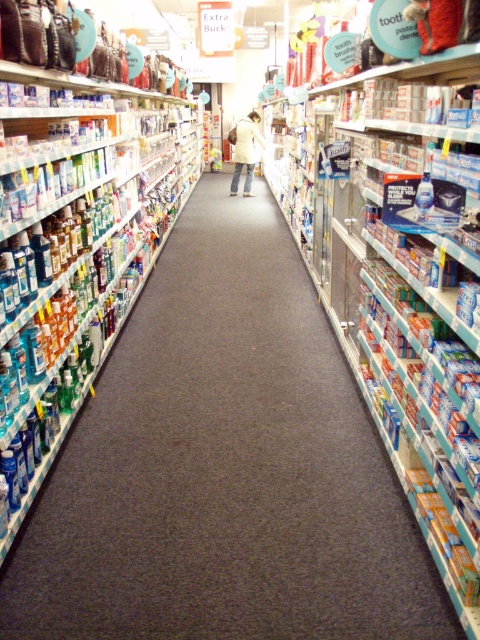
Who is positioned more to the left, blue plastic toothpaste at center or white matte coat at center?

white matte coat at center is more to the left.

This screenshot has width=480, height=640. Describe the element at coordinates (396, 269) in the screenshot. I see `blue plastic toothpaste at center` at that location.

Where is `blue plastic toothpaste at center`? blue plastic toothpaste at center is located at coordinates (396, 269).

Can you confirm if clear plastic bottles at center is smaller than white matte coat at center?

Correct, clear plastic bottles at center occupies less space than white matte coat at center.

Is point (119, 384) behind point (242, 125)?

No, (119, 384) is closer to viewer.

Describe the element at coordinates (224, 467) in the screenshot. Image resolution: width=480 pixels, height=640 pixels. I see `clear plastic bottles at center` at that location.

The height and width of the screenshot is (640, 480). Find the location of `clear plastic bottles at center`. clear plastic bottles at center is located at coordinates (224, 467).

Does clear plastic bottles at center appear on the left side of clear plastic bottles at left?

Incorrect, clear plastic bottles at center is not on the left side of clear plastic bottles at left.

Is clear plastic bottles at center taller than clear plastic bottles at left?

No.

Who is more distant from viewer, (x=73, y=486) or (x=128, y=145)?

The point (x=128, y=145) is behind.

Where is `clear plastic bottles at center`? This screenshot has height=640, width=480. clear plastic bottles at center is located at coordinates (224, 467).